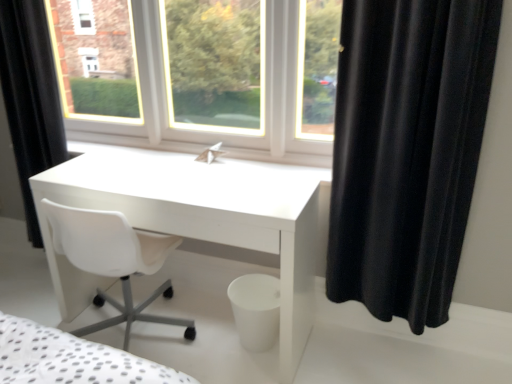
What do you see at coordinates (30, 97) in the screenshot? I see `black matte curtain at left, which ranks as the 2th curtain in front-to-back order` at bounding box center [30, 97].

Where is `white glossy desk at center`? The image size is (512, 384). white glossy desk at center is located at coordinates tap(201, 221).

Considering the positions of objects black velvet curtain at right, placed as the 2th curtain when sorted from left to right, and black matte curtain at left, which ranks as the 2th curtain in right-to-left order, in the image provided, who is more to the left, black velvet curtain at right, placed as the 2th curtain when sorted from left to right, or black matte curtain at left, which ranks as the 2th curtain in right-to-left order,?

black matte curtain at left, which ranks as the 2th curtain in right-to-left order.

Is the position of black velvet curtain at right, placed as the 2th curtain when sorted from left to right, less distant than that of black matte curtain at left, which ranks as the 2th curtain in right-to-left order?

Yes.

Locate an element on the screen. The image size is (512, 384). curtain located on the right of black matte curtain at left, the 1th curtain in the left-to-right sequence is located at coordinates (407, 151).

How different are the orientations of black matte curtain at left, the 1th curtain in the left-to-right sequence, and black velvet curtain at right, placed as the 2th curtain when sorted from left to right, in degrees?

4.35 degrees separate the facing orientations of black matte curtain at left, the 1th curtain in the left-to-right sequence, and black velvet curtain at right, placed as the 2th curtain when sorted from left to right.

Between point (36, 91) and point (380, 199), which one is positioned behind?

The point (36, 91) is more distant.

From a real-world perspective, between black matte curtain at left, the 1th curtain in the left-to-right sequence, and black velvet curtain at right, the 1th curtain from the right, who is vertically lower?

From a 3D spatial view, black velvet curtain at right, the 1th curtain from the right, is below.

From the image's perspective, is black matte curtain at left, the 1th curtain in the left-to-right sequence, located above or below black velvet curtain at right, marked as the 1th curtain in a front-to-back arrangement?

black matte curtain at left, the 1th curtain in the left-to-right sequence, is situated higher than black velvet curtain at right, marked as the 1th curtain in a front-to-back arrangement, in the image.

Does black matte curtain at left, which ranks as the 2th curtain in front-to-back order, touch white glossy desk at center?

black matte curtain at left, which ranks as the 2th curtain in front-to-back order, is not next to white glossy desk at center, and they're not touching.

Looking at this image, is black matte curtain at left, the 1th curtain from the back, turned away from white glossy desk at center?

That's not correct — black matte curtain at left, the 1th curtain from the back, is not looking away from white glossy desk at center.

Does point (9, 107) come closer to viewer compared to point (308, 281)?

No.

From the picture: Which is more to the right, black matte curtain at left, the 1th curtain in the left-to-right sequence, or white glossy desk at center?

Positioned to the right is white glossy desk at center.

In the scene shown: In terms of height, does white glossy desk at center look taller or shorter compared to black velvet curtain at right, placed as the 2th curtain when sorted from left to right?

Considering their sizes, white glossy desk at center has less height than black velvet curtain at right, placed as the 2th curtain when sorted from left to right.

Which of these two, white glossy desk at center or black velvet curtain at right, marked as the 1th curtain in a front-to-back arrangement, is thinner?

With smaller width is black velvet curtain at right, marked as the 1th curtain in a front-to-back arrangement.

From a real-world perspective, is white glossy desk at center over black velvet curtain at right, the 1th curtain from the right?

No, from a real-world perspective, white glossy desk at center is not above black velvet curtain at right, the 1th curtain from the right.

Where is `table below the black matte curtain at left, which ranks as the 2th curtain in right-to-left order (from the image's perspective)`? table below the black matte curtain at left, which ranks as the 2th curtain in right-to-left order (from the image's perspective) is located at coordinates (201, 221).

Is white glossy desk at center inside or outside of black matte curtain at left, which ranks as the 2th curtain in right-to-left order?

white glossy desk at center is located beyond the bounds of black matte curtain at left, which ranks as the 2th curtain in right-to-left order.

In the image, is white glossy desk at center positioned in front of or behind black matte curtain at left, which ranks as the 2th curtain in front-to-back order?

In the image, white glossy desk at center appears in front of black matte curtain at left, which ranks as the 2th curtain in front-to-back order.

Is point (137, 190) behind point (46, 91)?

No, it is in front of (46, 91).

Considering their positions, is black velvet curtain at right, the 1th curtain from the right, located in front of or behind white glossy desk at center?

Visually, black velvet curtain at right, the 1th curtain from the right, is located in front of white glossy desk at center.

Considering the sizes of objects black velvet curtain at right, the 1th curtain from the right, and white glossy desk at center in the image provided, who is wider, black velvet curtain at right, the 1th curtain from the right, or white glossy desk at center?

With larger width is white glossy desk at center.

From the image's perspective, is black velvet curtain at right, which is counted as the second curtain, starting from the back, located above white glossy desk at center?

Correct, black velvet curtain at right, which is counted as the second curtain, starting from the back, appears higher than white glossy desk at center in the image.

Is point (446, 10) closer to camera compared to point (279, 209)?

Yes, point (446, 10) is in front of point (279, 209).

Where is `curtain above the black velvet curtain at right, placed as the 2th curtain when sorted from left to right (from a real-world perspective)`? The height and width of the screenshot is (384, 512). curtain above the black velvet curtain at right, placed as the 2th curtain when sorted from left to right (from a real-world perspective) is located at coordinates (30, 97).

The image size is (512, 384). I want to click on curtain behind the black velvet curtain at right, the 1th curtain from the right, so click(30, 97).

From the image, which object appears to be nearer to white glossy desk at center, black velvet curtain at right, placed as the 2th curtain when sorted from left to right, or black matte curtain at left, which ranks as the 2th curtain in right-to-left order?

black velvet curtain at right, placed as the 2th curtain when sorted from left to right, lies closer to white glossy desk at center than the other object.

Estimate the real-world distances between objects in this image. Which object is further from black matte curtain at left, the 1th curtain in the left-to-right sequence, black velvet curtain at right, the 1th curtain from the right, or white glossy desk at center?

black velvet curtain at right, the 1th curtain from the right.

Which object lies further to the anchor point black matte curtain at left, the 1th curtain in the left-to-right sequence, white glossy desk at center or black velvet curtain at right, marked as the 1th curtain in a front-to-back arrangement?

black velvet curtain at right, marked as the 1th curtain in a front-to-back arrangement, lies further to black matte curtain at left, the 1th curtain in the left-to-right sequence, than the other object.

Based on their spatial positions, is white glossy desk at center or black matte curtain at left, which ranks as the 2th curtain in right-to-left order, further from black velvet curtain at right, the 1th curtain from the right?

Among the two, black matte curtain at left, which ranks as the 2th curtain in right-to-left order, is located further to black velvet curtain at right, the 1th curtain from the right.

Estimate the real-world distances between objects in this image. Which object is closer to white glossy desk at center, black matte curtain at left, which ranks as the 2th curtain in right-to-left order, or black velvet curtain at right, the 1th curtain from the right?

black velvet curtain at right, the 1th curtain from the right.

Based on the photo, based on their spatial positions, is black matte curtain at left, the 1th curtain from the back, or white glossy desk at center further from black velvet curtain at right, marked as the 1th curtain in a front-to-back arrangement?

black matte curtain at left, the 1th curtain from the back, is positioned further to the anchor black velvet curtain at right, marked as the 1th curtain in a front-to-back arrangement.

This screenshot has width=512, height=384. I want to click on table between black matte curtain at left, the 1th curtain in the left-to-right sequence, and black velvet curtain at right, marked as the 1th curtain in a front-to-back arrangement, from left to right, so click(x=201, y=221).